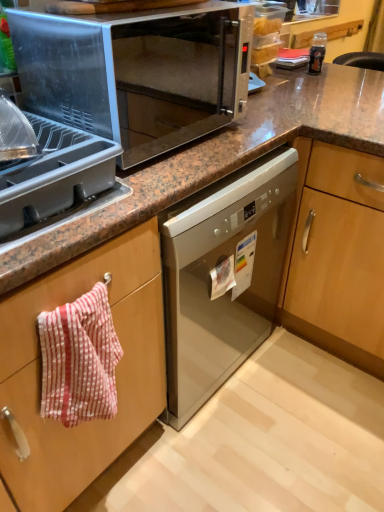
Image resolution: width=384 pixels, height=512 pixels. In order to click on satin silver microwave at upper center in this screenshot , I will do `click(137, 73)`.

From a real-world perspective, is red striped towel at left on top of satin silver microwave at upper center?

No, from a real-world perspective, red striped towel at left is not over satin silver microwave at upper center

In the scene shown: Is satin silver microwave at upper center a part of red striped towel at left?

No, satin silver microwave at upper center is not a part of red striped towel at left.

Relative to satin silver microwave at upper center, is red striped towel at left in front or behind?

red striped towel at left is positioned closer to the viewer than satin silver microwave at upper center.

From the image's perspective, is red striped towel at left above or below satin silver microwave at upper center?

red striped towel at left is situated lower than satin silver microwave at upper center in the image.

From a real-world perspective, is satin silver microwave at upper center beneath red striped towel at left?

No.

Would you say satin silver microwave at upper center is outside red striped towel at left?

Yes, satin silver microwave at upper center is not within red striped towel at left.

Considering their positions, is satin silver microwave at upper center located in front of or behind red striped towel at left?

satin silver microwave at upper center is positioned farther from the viewer than red striped towel at left.

From the image's perspective, is satin silver microwave at upper center beneath red striped towel at left?

No, from the image's perspective, satin silver microwave at upper center is not beneath red striped towel at left.

From the image's perspective, is gray plastic tray at upper left located above or below red striped towel at left?

gray plastic tray at upper left is situated higher than red striped towel at left in the image.

Are gray plastic tray at upper left and red striped towel at left far apart?

No, there isn't a large distance between gray plastic tray at upper left and red striped towel at left.

Which object is further away from the camera, gray plastic tray at upper left or red striped towel at left?

red striped towel at left is behind.

Is red striped towel at left at the back of gray plastic tray at upper left?

No, red striped towel at left is not at the back of gray plastic tray at upper left.

Who is shorter, gray plastic tray at upper left or satin silver microwave at upper center?

gray plastic tray at upper left.

Is gray plastic tray at upper left positioned behind satin silver microwave at upper center?

No, it is not.

How distant is gray plastic tray at upper left from satin silver microwave at upper center?

gray plastic tray at upper left and satin silver microwave at upper center are 8.70 inches apart.

Can you confirm if gray plastic tray at upper left is thinner than satin silver microwave at upper center?

Yes.

Does red striped towel at left turn towards gray plastic tray at upper left?

No, red striped towel at left is not turned towards gray plastic tray at upper left.

From a real-world perspective, is red striped towel at left on top of gray plastic tray at upper left?

Actually, red striped towel at left is physically below gray plastic tray at upper left in the real world.

Does red striped towel at left appear on the left side of gray plastic tray at upper left?

No.

From the image's perspective, is red striped towel at left on top of gray plastic tray at upper left?

No, from the image's perspective, red striped towel at left is not over gray plastic tray at upper left.

Considering the relative positions of satin silver microwave at upper center and gray plastic tray at upper left in the image provided, is satin silver microwave at upper center to the right of gray plastic tray at upper left from the viewer's perspective?

Indeed, satin silver microwave at upper center is positioned on the right side of gray plastic tray at upper left.

Is satin silver microwave at upper center positioned far away from gray plastic tray at upper left?

No, there isn't a large distance between satin silver microwave at upper center and gray plastic tray at upper left.

Which is behind, point (178, 49) or point (9, 199)?

The point (178, 49) is more distant.

Considering the sizes of objects satin silver microwave at upper center and gray plastic tray at upper left in the image provided, who is shorter, satin silver microwave at upper center or gray plastic tray at upper left?

gray plastic tray at upper left.

Locate an element on the screen. This screenshot has height=512, width=384. cabinetry that appears on the left of satin silver microwave at upper center is located at coordinates (116, 370).

Where is `cabinetry in front of the satin silver microwave at upper center`? This screenshot has height=512, width=384. cabinetry in front of the satin silver microwave at upper center is located at coordinates (116, 370).

From the image, which object appears to be nearer to gray plastic tray at upper left, satin silver microwave at upper center or red striped towel at left?

The object closer to gray plastic tray at upper left is satin silver microwave at upper center.

Looking at the image, which one is located closer to satin silver microwave at upper center, gray plastic tray at upper left or red striped towel at left?

Among the two, gray plastic tray at upper left is located nearer to satin silver microwave at upper center.

Considering their positions, is red striped towel at left positioned closer to satin silver microwave at upper center than gray plastic tray at upper left?

Among the two, gray plastic tray at upper left is located nearer to satin silver microwave at upper center.

Estimate the real-world distances between objects in this image. Which object is closer to red striped towel at left, gray plastic tray at upper left or satin silver microwave at upper center?

gray plastic tray at upper left lies closer to red striped towel at left than the other object.

Considering their positions, is satin silver microwave at upper center positioned further to red striped towel at left than gray plastic tray at upper left?

satin silver microwave at upper center is positioned further to the anchor red striped towel at left.

Based on their spatial positions, is red striped towel at left or satin silver microwave at upper center further from gray plastic tray at upper left?

Among the two, red striped towel at left is located further to gray plastic tray at upper left.

Locate an element on the screen. This screenshot has width=384, height=512. appliance that lies between satin silver microwave at upper center and red striped towel at left from top to bottom is located at coordinates (58, 128).